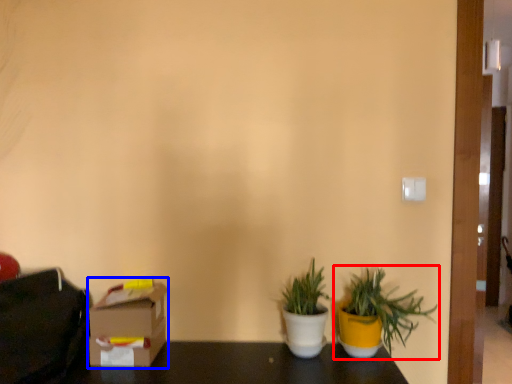
Question: Among these objects, which one is nearest to the camera, houseplant (highlighted by a red box) or cardboard box (highlighted by a blue box)?

Choices:
 (A) houseplant
 (B) cardboard box

Answer: (A)